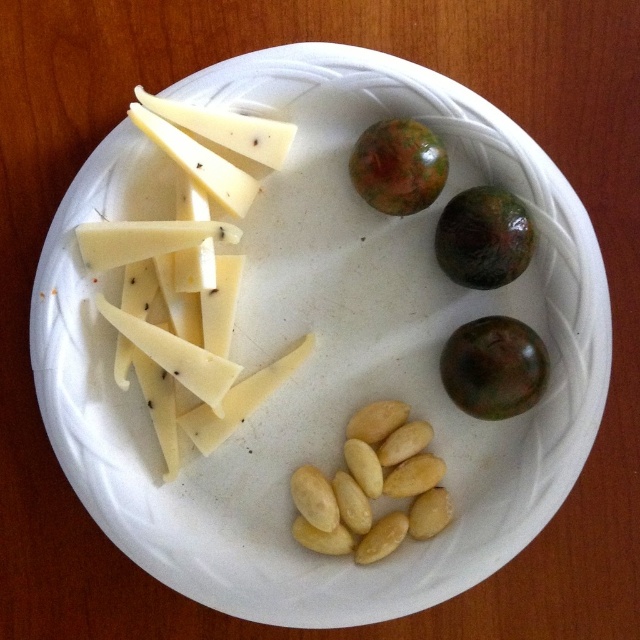
You are a food critic sitting at a table with the white plate in front of you. You want to pick up the yellow cheese at upper left and the yellow matte almonds at lower center. Which one is easier to reach without moving your hand?

The yellow cheese at upper left is closer to the viewer than the yellow matte almonds at lower center, so it is easier to reach without moving your hand.

You have a small container that can only hold items wider than 5 cm. You need to decide which of the yellow matte almonds at lower center or the green matte passion fruit at upper right can fit into the container based on their widths. Which one can fit?

The yellow matte almonds at lower center can fit into the container because its width is larger than the green matte passion fruit at upper right, so it meets the container requirement of holding items wider than 5 cm.

You are a food stylist arranging items on a plate. You have a yellow matte almonds at lower center and a green matte passion fruit at upper right. Which item is taller?

The yellow matte almonds at lower center is taller than the green matte passion fruit at upper right.